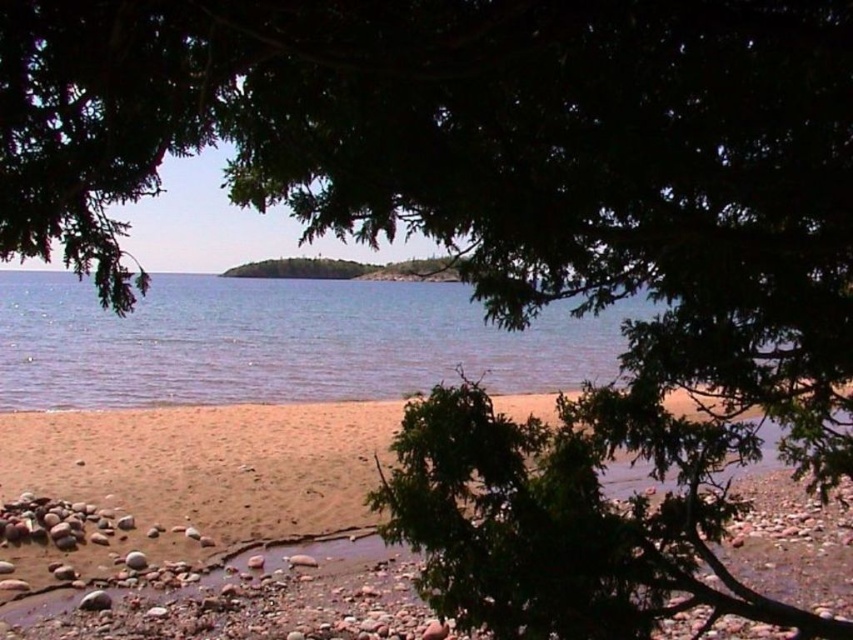
Question: Where is brown sand at lower center located in relation to clear blue water at center in the image?

Choices:
 (A) left
 (B) right

Answer: (B)

Question: Which object is closer to the camera taking this photo?

Choices:
 (A) clear blue water at center
 (B) brown sand at lower center

Answer: (A)

Question: Does brown sand at lower center have a lesser width compared to clear blue water at center?

Choices:
 (A) yes
 (B) no

Answer: (A)

Question: Can you confirm if brown sand at lower center is positioned below clear blue water at center?

Choices:
 (A) no
 (B) yes

Answer: (B)